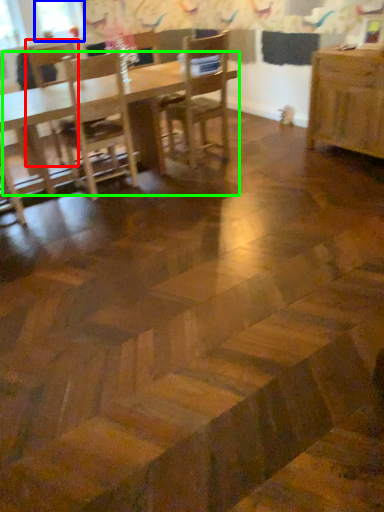
Question: Which object is the farthest from chair (highlighted by a red box)? Choose among these: window screen (highlighted by a blue box) or table (highlighted by a green box).

Choices:
 (A) window screen
 (B) table

Answer: (B)